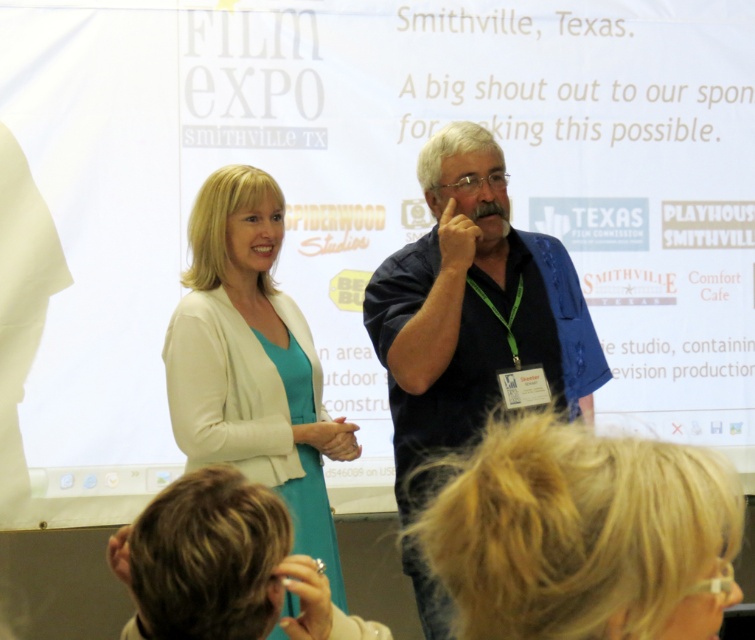
Between point (399, 449) and point (321, 525), which one is positioned in front?

Point (321, 525) is in front.

Does point (414, 364) come farther from viewer compared to point (233, 285)?

No, (414, 364) is closer to viewer.

Is point (472, 385) positioned after point (211, 376)?

Yes, point (472, 385) is behind point (211, 376).

Locate an element on the screen. The height and width of the screenshot is (640, 755). blue cotton shirt at center is located at coordinates (473, 314).